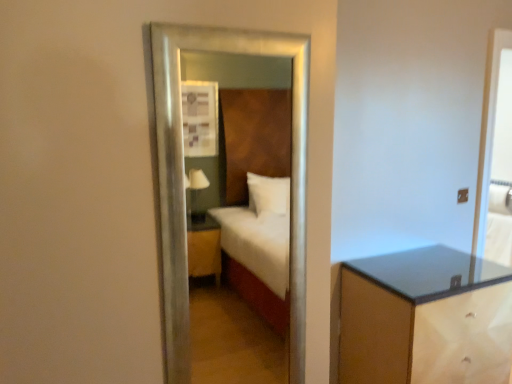
Locate an element on the screen. silver metallic mirror at center is located at coordinates (182, 180).

Considering the relative sizes of clear glass screen door at right and matte brown nightstand at lower right in the image provided, is clear glass screen door at right wider than matte brown nightstand at lower right?

Incorrect, the width of clear glass screen door at right does not surpass that of matte brown nightstand at lower right.

Consider the image. Does clear glass screen door at right turn towards matte brown nightstand at lower right?

No, clear glass screen door at right is not turned towards matte brown nightstand at lower right.

From the image's perspective, relative to matte brown nightstand at lower right, is clear glass screen door at right above or below?

Clearly, from the image's perspective, clear glass screen door at right is above matte brown nightstand at lower right.

Is clear glass screen door at right beside matte brown nightstand at lower right?

They are not placed beside each other.

Would you say silver metallic mirror at center is to the left or to the right of clear glass screen door at right in the picture?

In the image, silver metallic mirror at center appears on the left side of clear glass screen door at right.

From the picture: From a real-world perspective, who is located higher, silver metallic mirror at center or clear glass screen door at right?

In real-world perspective, clear glass screen door at right is above.

Based on the photo, is silver metallic mirror at center beside clear glass screen door at right?

silver metallic mirror at center and clear glass screen door at right are not in contact.

Is point (185, 240) less distant than point (503, 41)?

Yes.

Does point (382, 373) appear closer or farther from the camera than point (297, 139)?

Point (382, 373) is positioned farther from the camera compared to point (297, 139).

Can you confirm if matte brown nightstand at lower right is smaller than silver metallic mirror at center?

Incorrect, matte brown nightstand at lower right is not smaller in size than silver metallic mirror at center.

From a real-world perspective, is matte brown nightstand at lower right on silver metallic mirror at center?

No, from a real-world perspective, matte brown nightstand at lower right is not on top of silver metallic mirror at center.

Looking at this image, is matte brown nightstand at lower right oriented towards silver metallic mirror at center?

No, matte brown nightstand at lower right is not oriented towards silver metallic mirror at center.

Can silver metallic mirror at center be found inside clear glass screen door at right?

That's incorrect, silver metallic mirror at center is not inside clear glass screen door at right.

Looking at this image, between clear glass screen door at right and silver metallic mirror at center, which one has smaller size?

With smaller size is clear glass screen door at right.

How different are the orientations of clear glass screen door at right and silver metallic mirror at center in degrees?

The facing directions of clear glass screen door at right and silver metallic mirror at center are 0.403 degrees apart.

Is clear glass screen door at right oriented away from silver metallic mirror at center?

No, clear glass screen door at right is not facing the opposite direction of silver metallic mirror at center.

Image resolution: width=512 pixels, height=384 pixels. Find the location of `nightstand below the clear glass screen door at right (from a real-world perspective)`. nightstand below the clear glass screen door at right (from a real-world perspective) is located at coordinates (425, 318).

Is matte brown nightstand at lower right situated inside clear glass screen door at right or outside?

matte brown nightstand at lower right is located beyond the bounds of clear glass screen door at right.

Which object is further away from the camera, matte brown nightstand at lower right or clear glass screen door at right?

clear glass screen door at right.

Does silver metallic mirror at center have a greater width compared to matte brown nightstand at lower right?

Incorrect, the width of silver metallic mirror at center does not surpass that of matte brown nightstand at lower right.

I want to click on mirror in front of the matte brown nightstand at lower right, so click(182, 180).

From a real-world perspective, who is located higher, silver metallic mirror at center or matte brown nightstand at lower right?

From a 3D spatial view, silver metallic mirror at center is above.

Identify the location of screen door that is above the matte brown nightstand at lower right (from the image's perspective). Image resolution: width=512 pixels, height=384 pixels. (495, 157).

Identify the location of mirror on the left of clear glass screen door at right. (182, 180).

Looking at the image, which one is located closer to silver metallic mirror at center, clear glass screen door at right or matte brown nightstand at lower right?

matte brown nightstand at lower right is positioned closer to the anchor silver metallic mirror at center.

Looking at the image, which one is located further to clear glass screen door at right, matte brown nightstand at lower right or silver metallic mirror at center?

Based on the image, silver metallic mirror at center appears to be further to clear glass screen door at right.

Looking at the image, which one is located further to clear glass screen door at right, silver metallic mirror at center or matte brown nightstand at lower right?

silver metallic mirror at center is positioned further to the anchor clear glass screen door at right.

Estimate the real-world distances between objects in this image. Which object is further from silver metallic mirror at center, matte brown nightstand at lower right or clear glass screen door at right?

The object further to silver metallic mirror at center is clear glass screen door at right.

Based on the photo, based on their spatial positions, is silver metallic mirror at center or clear glass screen door at right closer to matte brown nightstand at lower right?

Based on the image, clear glass screen door at right appears to be nearer to matte brown nightstand at lower right.

Estimate the real-world distances between objects in this image. Which object is further from matte brown nightstand at lower right, clear glass screen door at right or silver metallic mirror at center?

silver metallic mirror at center.

Where is `nightstand situated between silver metallic mirror at center and clear glass screen door at right from left to right`? Image resolution: width=512 pixels, height=384 pixels. nightstand situated between silver metallic mirror at center and clear glass screen door at right from left to right is located at coordinates (425, 318).